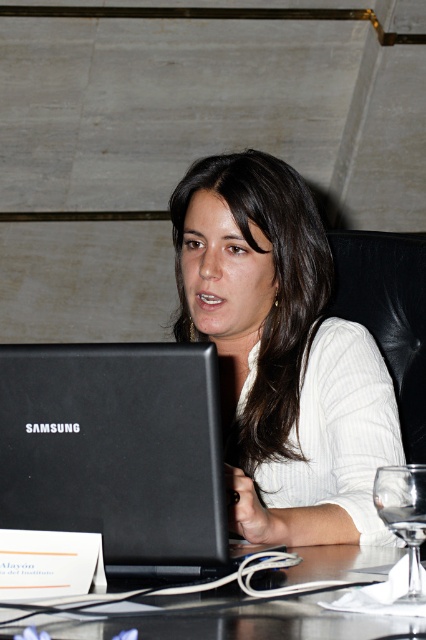
You are organizing a presentation and need to place both the black matte laptop at center and the white ribbed sweater at center on a table. If the table has limited space, which item should you place first to ensure both fit?

The white ribbed sweater at center should be placed first since the black matte laptop at center is wider and requires more space.

You are a conference attendee who needs to locate the laptop of the person named Alayon. According to the scene description, where is the black matte laptop at center located relative to the point with coordinates (118, 452)?

The point with coordinates (118, 452) is located on the black matte laptop at center, meaning the laptop is exactly where that point is marked.

You are organizing a meeting and need to place a 12x12 inch placemat on the table. Given the black matte laptop at center and the transparent glass at lower right, which object can the placemat fit under without overlapping?

The black matte laptop at center has a larger width than the transparent glass at lower right, so the placemat would fit better under the black matte laptop at center since it has more space.